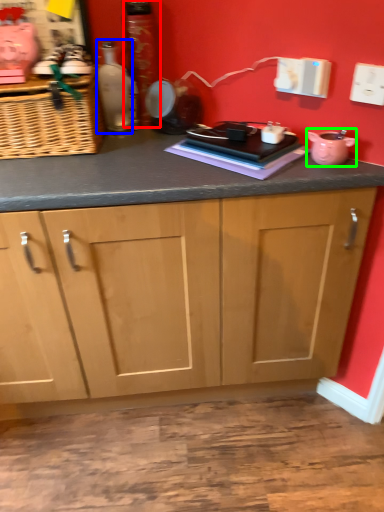
Question: Estimate the real-world distances between objects in this image. Which object is farther from bottle (highlighted by a red box), bottle (highlighted by a blue box) or appliance (highlighted by a green box)?

Choices:
 (A) bottle
 (B) appliance

Answer: (B)